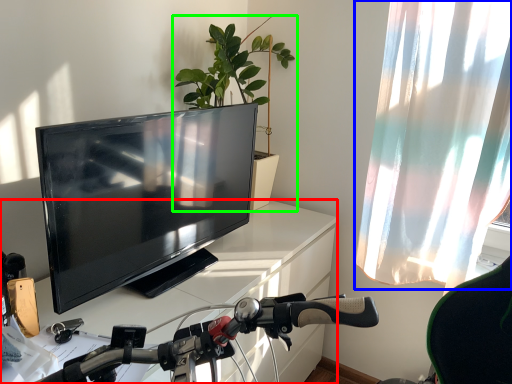
Question: Based on their relative distances, which object is nearer to desk (highlighted by a red box)? Choose from curtain (highlighted by a blue box) and houseplant (highlighted by a green box).

Choices:
 (A) curtain
 (B) houseplant

Answer: (B)